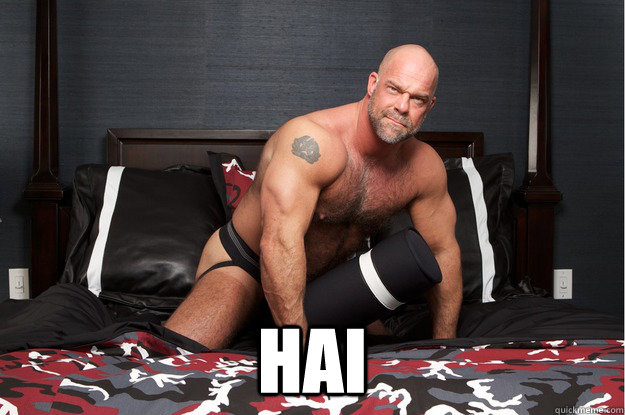
I want to click on bed pillow, so click(x=179, y=203).